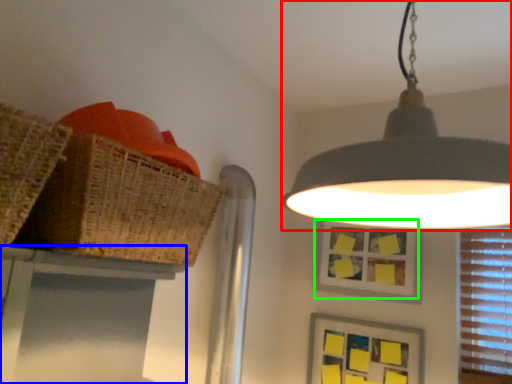
Question: Which object is positioned closest to lamp (highlighted by a red box)? Select from table (highlighted by a blue box) and picture frame (highlighted by a green box).

Choices:
 (A) table
 (B) picture frame

Answer: (A)